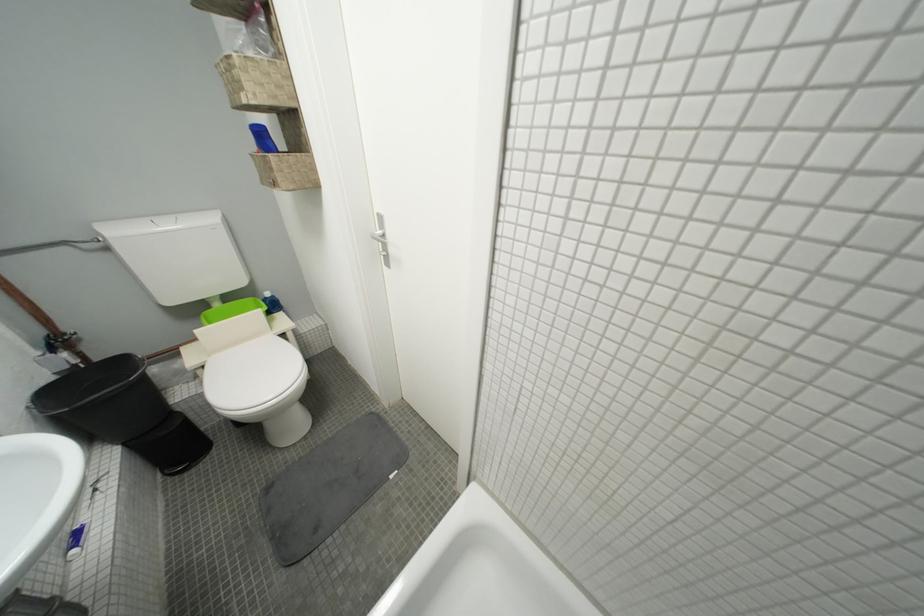
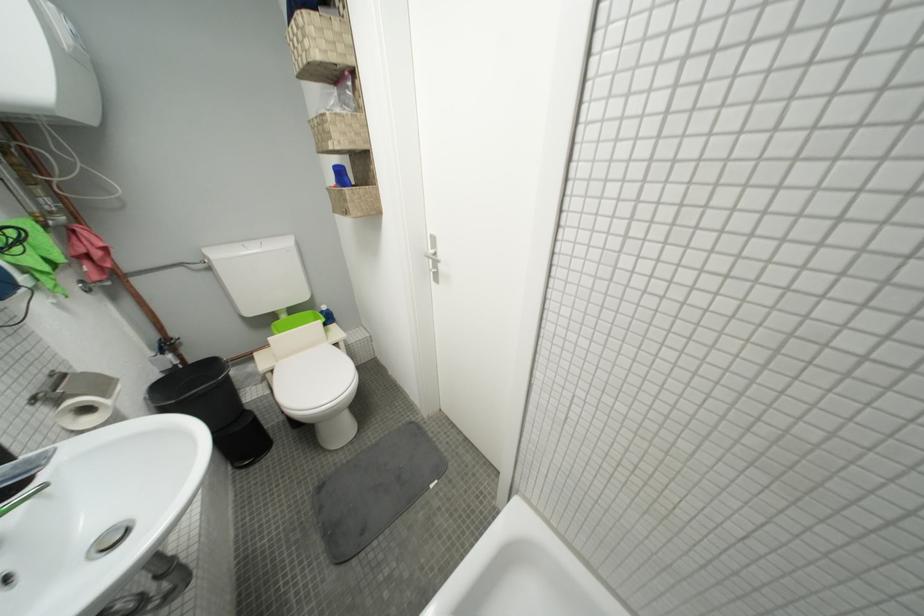
In the second image, find the point that corresponds to the point at 284,188 in the first image.

(354, 216)